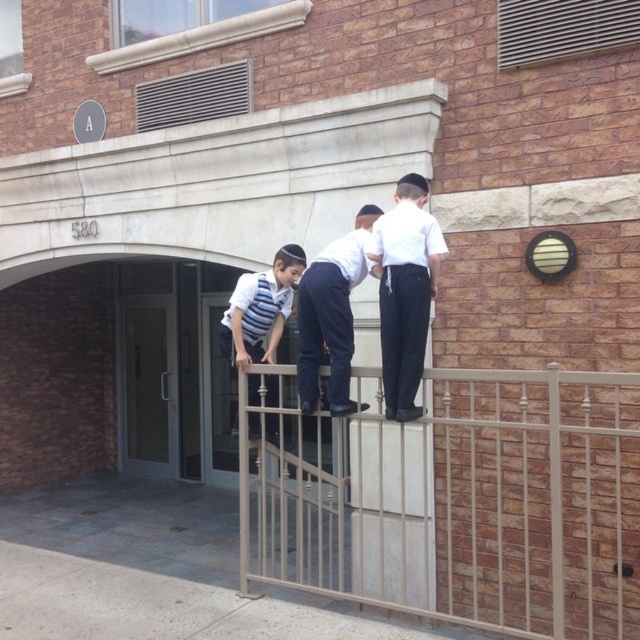
Question: Among these objects, which one is nearest to the camera?

Choices:
 (A) white matte uniform at center
 (B) white cotton shirt at upper center

Answer: (B)

Question: Which point is closer to the camera?

Choices:
 (A) (419, 256)
 (B) (268, 380)
 (C) (340, 352)

Answer: (A)

Question: Which point appears farthest from the camera in this image?

Choices:
 (A) click(570, 449)
 (B) click(342, 257)
 (C) click(266, 387)
 (D) click(396, 220)

Answer: (C)

Question: Considering the relative positions of white cotton shirt at upper center and striped fabric shirt at upper center in the image provided, where is white cotton shirt at upper center located with respect to striped fabric shirt at upper center?

Choices:
 (A) left
 (B) right

Answer: (B)

Question: Can you confirm if white cotton shirt at upper center is smaller than striped fabric shirt at upper center?

Choices:
 (A) no
 (B) yes

Answer: (B)

Question: Can you confirm if white cotton shirt at upper center is thinner than striped fabric shirt at upper center?

Choices:
 (A) no
 (B) yes

Answer: (B)